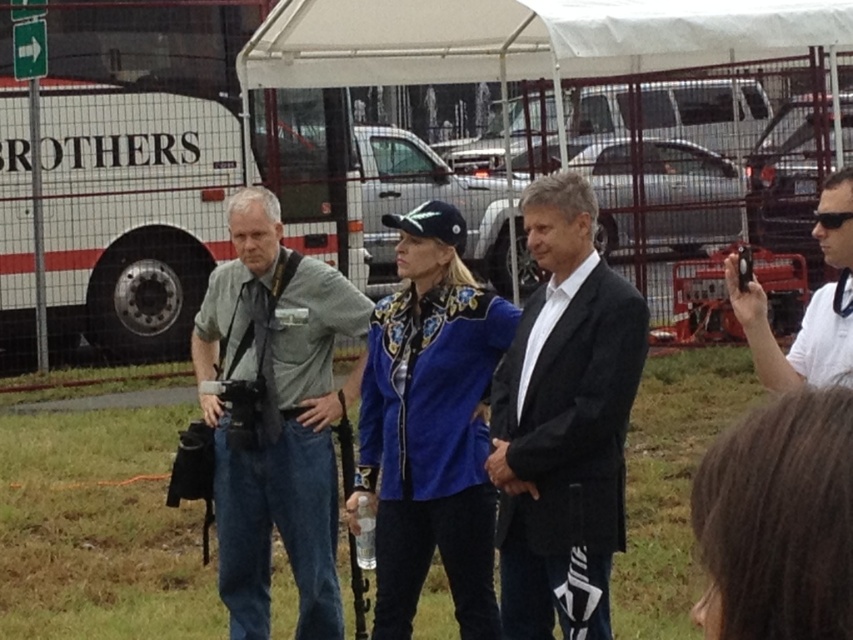
You are standing in the scene and want to locate the white fabric canopy at upper center. According to the coordinates provided, where exactly is it positioned?

The white fabric canopy at upper center is positioned at the coordinates point (524, 38).

You are a photographer trying to capture a candid shot of the woman in the center without her noticing. The black matte camera at right is on a tripod placed 2 meters away from the blue suede jacket at center. Can you use the camera to take a clear photo of the jacket?

The blue suede jacket at center is taller than the black matte camera at right, so the camera might not capture the entire jacket in the frame unless adjusted. However, since the camera is on a tripod 2 meters away, you can lower the camera angle or zoom in to ensure the entire jacket is visible.